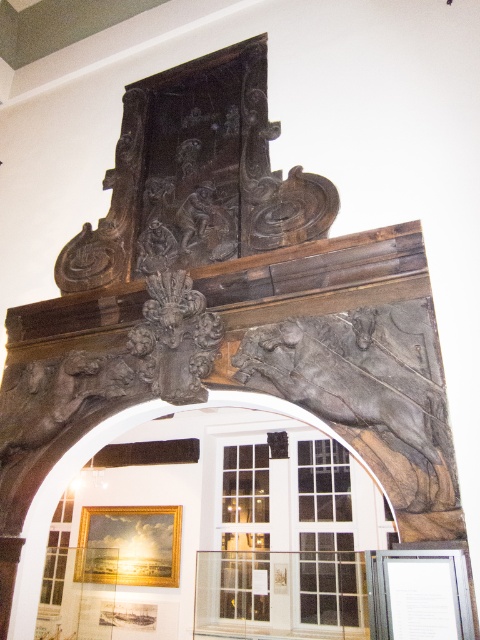
Question: Can you confirm if dark gray stone horse at center is thinner than dark stone archway at center?

Choices:
 (A) no
 (B) yes

Answer: (B)

Question: Can you confirm if dark gray stone horse at center is positioned below dark stone archway at center?

Choices:
 (A) yes
 (B) no

Answer: (B)

Question: Is dark gray stone horse at center further to camera compared to dark stone archway at center?

Choices:
 (A) no
 (B) yes

Answer: (A)